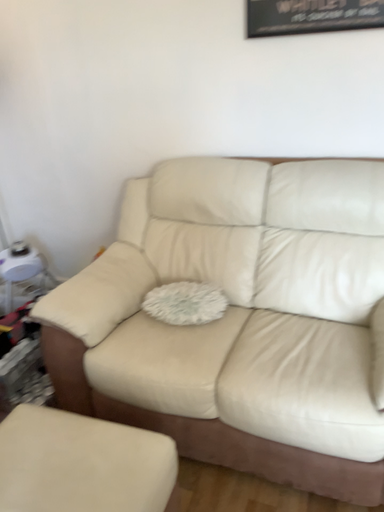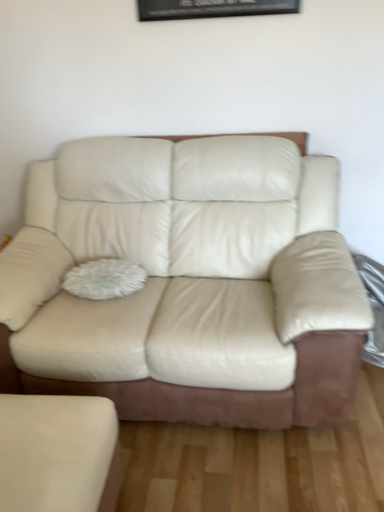
Question: Which way did the camera rotate in the video?

Choices:
 (A) rotated left
 (B) rotated right

Answer: (B)